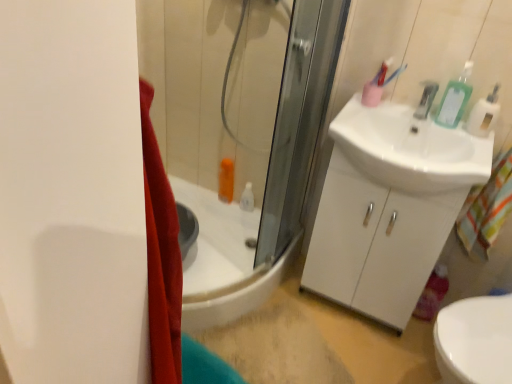
Question: From the image's perspective, is metallic silver faucet at upper right positioned above or below white glossy cabinet at right?

Choices:
 (A) below
 (B) above

Answer: (B)

Question: In terms of size, does metallic silver faucet at upper right appear bigger or smaller than white glossy cabinet at right?

Choices:
 (A) big
 (B) small

Answer: (B)

Question: Estimate the real-world distances between objects in this image. Which object is closer to the white glossy cabinet at right?

Choices:
 (A) white glossy sink at right
 (B) green plastic bottle at upper right
 (C) metallic silver faucet at upper right
 (D) white plastic soap dispenser at upper right

Answer: (A)

Question: Estimate the real-world distances between objects in this image. Which object is farther from the white glossy sink at right?

Choices:
 (A) green plastic bottle at upper right
 (B) white plastic soap dispenser at upper right
 (C) metallic silver faucet at upper right
 (D) white glossy cabinet at right

Answer: (B)